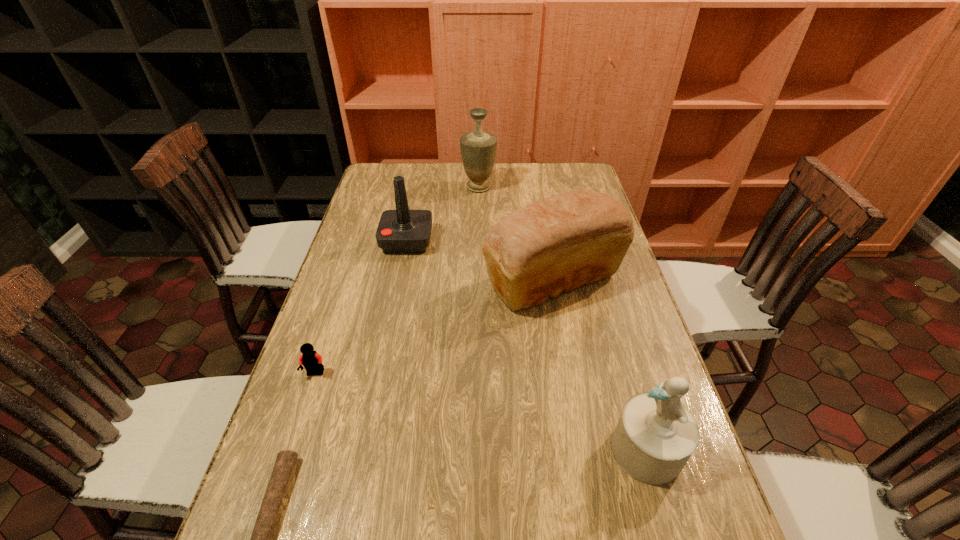
Where is `free space located at the beak of the figurine`? This screenshot has width=960, height=540. free space located at the beak of the figurine is located at coordinates (466, 450).

The width and height of the screenshot is (960, 540). Identify the location of free region located on the back of the fourth object from right to left. (413, 211).

Locate an element on the screen. The image size is (960, 540). blank space located 0.330m on the front-facing side of the fifth tallest object is located at coordinates (261, 537).

Identify the location of object at the far edge. (478, 148).

Where is `joystick present at the left edge`? This screenshot has height=540, width=960. joystick present at the left edge is located at coordinates (402, 231).

Find the location of `Lego positioned at the left edge`. Lego positioned at the left edge is located at coordinates (310, 359).

In order to click on bread located at the right edge in this screenshot , I will do `click(560, 243)`.

Locate an element on the screen. This screenshot has width=960, height=540. figurine that is positioned at the right edge is located at coordinates (656, 435).

You are a GUI agent. You are given a task and a screenshot of the screen. Output one action in this format:
    pyautogui.click(x=<x>, y=<y>)
    Task: Click on the vacant space at the far edge of the desktop
    This screenshot has height=540, width=960.
    Given the screenshot: What is the action you would take?
    pyautogui.click(x=461, y=165)

I want to click on vacant space at the left edge of the desktop, so click(337, 404).